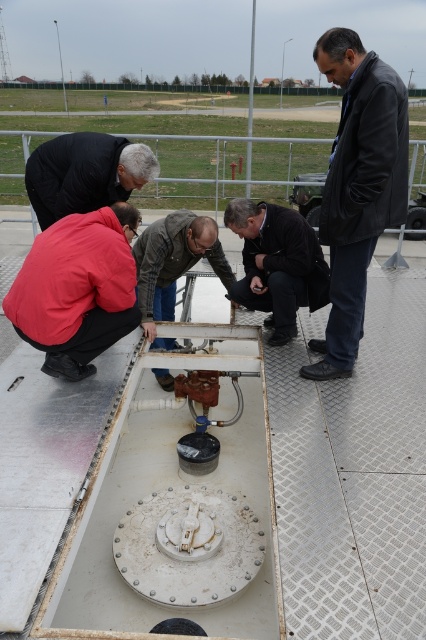
Is point (109, 218) farther from camera compared to point (103, 177)?

That is False.

From the picture: Does red matte jacket at lower left have a greater height compared to black matte jacket at center?

Correct, red matte jacket at lower left is much taller as black matte jacket at center.

Is point (25, 268) positioned before point (86, 193)?

Yes, it is in front of point (86, 193).

The image size is (426, 640). Identify the location of red matte jacket at lower left. (77, 289).

Locate an element on the screen. black leather jacket at upper right is located at coordinates (357, 188).

Is point (354, 157) in front of point (94, 173)?

Yes, it is in front of point (94, 173).

Which is in front, point (368, 147) or point (68, 157)?

Point (368, 147)

Find the location of `black leather jacket at upper right`. black leather jacket at upper right is located at coordinates (357, 188).

Between point (39, 170) and point (172, 320), which one is positioned behind?

Point (172, 320)

Between black matte jacket at center and brown leather jacket at center, which one appears on the left side from the viewer's perspective?

Positioned to the left is black matte jacket at center.

Which is behind, point (121, 145) or point (155, 342)?

Positioned behind is point (155, 342).

I want to click on black matte jacket at center, so click(x=85, y=173).